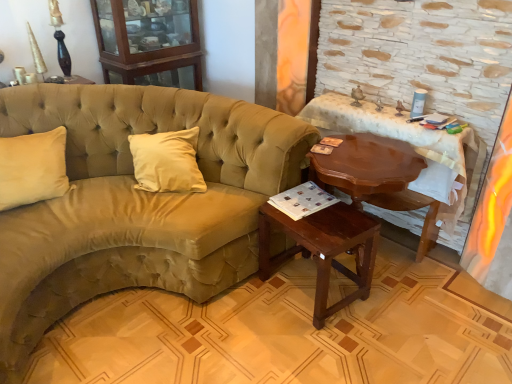
Question: Is wooden cabinet at upper left inside or outside of suede-like beige couch at left?

Choices:
 (A) outside
 (B) inside

Answer: (A)

Question: In terms of height, does wooden cabinet at upper left look taller or shorter compared to suede-like beige couch at left?

Choices:
 (A) tall
 (B) short

Answer: (B)

Question: Considering the real-world distances, which object is farthest from the wooden cabinet at upper left?

Choices:
 (A) mahogany wood side table at lower center, which is counted as the 2th table, starting from the right
 (B) suede-like beige couch at left
 (C) mahogany wood table at right, which is the 1th table from right to left

Answer: (A)

Question: Estimate the real-world distances between objects in this image. Which object is farther from the mahogany wood side table at lower center, which is counted as the 2th table, starting from the right?

Choices:
 (A) suede-like beige couch at left
 (B) wooden cabinet at upper left
 (C) mahogany wood table at right, the 2th table from the left

Answer: (B)